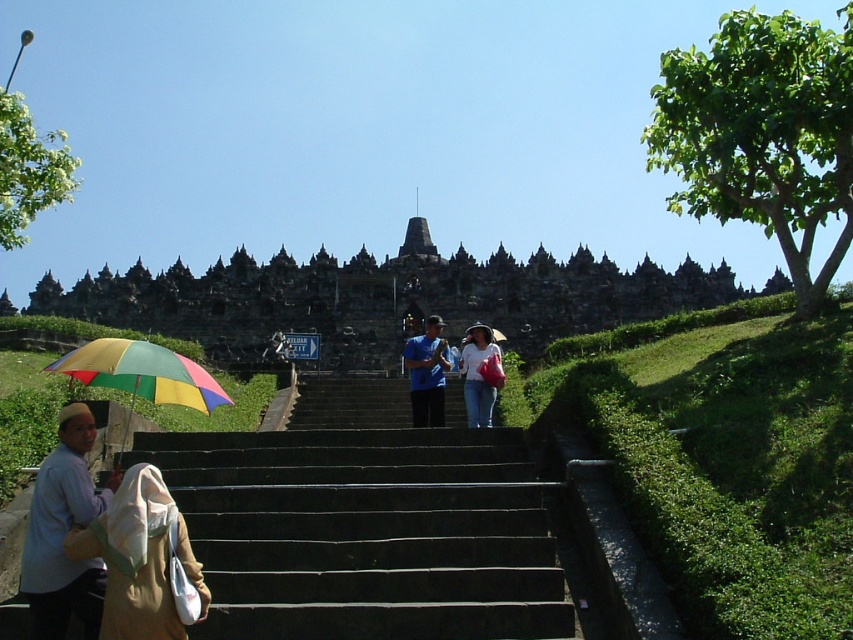
Question: Is dark gray stone temple at center positioned in front of light blue shirt at lower left?

Choices:
 (A) yes
 (B) no

Answer: (B)

Question: Which object is farther from the camera taking this photo?

Choices:
 (A) blue fabric shirt at center
 (B) light brown fabric at lower left
 (C) denim jeans at center
 (D) dark gray stone temple at center

Answer: (D)

Question: Is light brown fabric at lower left closer to camera compared to rainbow fabric umbrella at lower left?

Choices:
 (A) no
 (B) yes

Answer: (B)

Question: Does rainbow fabric umbrella at lower left have a smaller size compared to rainbow fabric umbrella at center?

Choices:
 (A) no
 (B) yes

Answer: (A)

Question: Estimate the real-world distances between objects in this image. Which object is farther from the light brown fabric at lower left?

Choices:
 (A) rainbow fabric umbrella at center
 (B) light blue shirt at lower left
 (C) dark gray stone temple at center
 (D) black stone stairs at center

Answer: (C)

Question: Among these points, which one is farthest from the camera?

Choices:
 (A) pos(418,397)
 (B) pos(100,381)
 (C) pos(480,378)

Answer: (A)